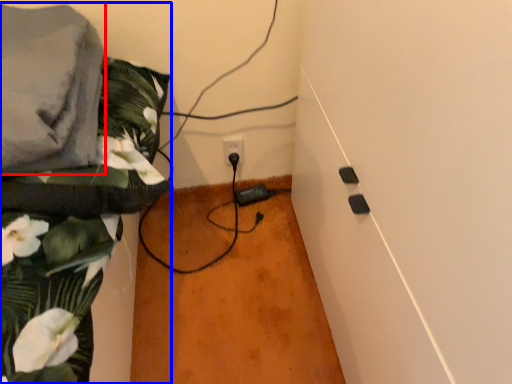
Question: Among these objects, which one is nearest to the camera, linen (highlighted by a red box) or textile (highlighted by a blue box)?

Choices:
 (A) linen
 (B) textile

Answer: (A)